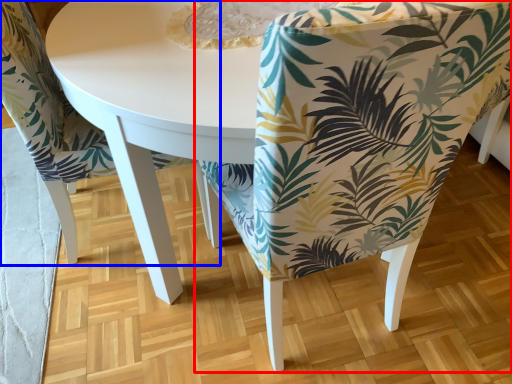
Question: Which point is further to the camera, chair (highlighted by a red box) or chair (highlighted by a blue box)?

Choices:
 (A) chair
 (B) chair

Answer: (B)